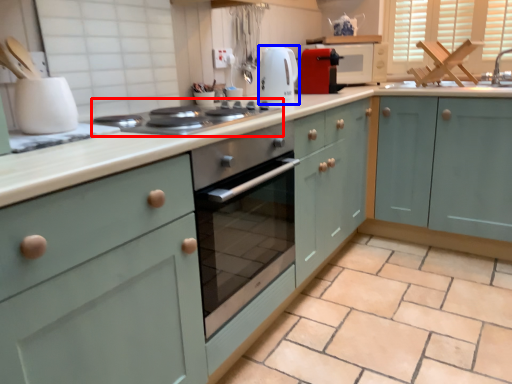
Question: Which object appears farthest to the camera in this image, home appliance (highlighted by a red box) or kitchen appliance (highlighted by a blue box)?

Choices:
 (A) home appliance
 (B) kitchen appliance

Answer: (B)